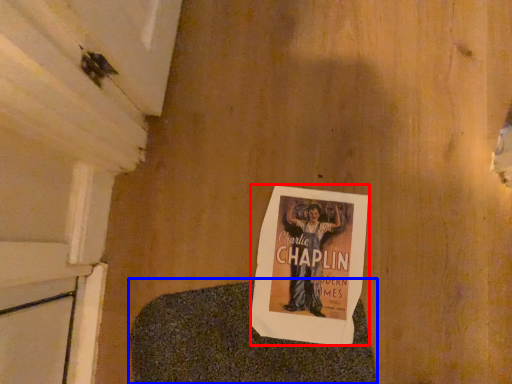
Question: Which object is closer to the camera taking this photo, poster (highlighted by a red box) or blanket (highlighted by a blue box)?

Choices:
 (A) poster
 (B) blanket

Answer: (B)